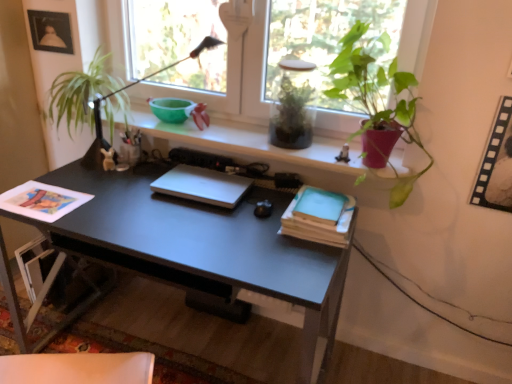
Question: Is matte white shelf at upper center positioned far away from light blue matte paper at center right, the second paperback book when ordered from bottom to top?

Choices:
 (A) no
 (B) yes

Answer: (A)

Question: Considering the relative sizes of matte white shelf at upper center and light blue matte paper at center right, the second paperback book when ordered from bottom to top, in the image provided, is matte white shelf at upper center taller than light blue matte paper at center right, the second paperback book when ordered from bottom to top,?

Choices:
 (A) no
 (B) yes

Answer: (B)

Question: Would you say matte white shelf at upper center contains light blue matte paper at center right, the first paperback book viewed from the top?

Choices:
 (A) yes
 (B) no

Answer: (B)

Question: Is matte white shelf at upper center smaller than light blue matte paper at center right, the second paperback book when ordered from bottom to top?

Choices:
 (A) no
 (B) yes

Answer: (A)

Question: Is matte white shelf at upper center positioned with its back to light blue matte paper at center right, the second paperback book when ordered from bottom to top?

Choices:
 (A) yes
 (B) no

Answer: (B)

Question: From a real-world perspective, is matte white shelf at upper center beneath light blue matte paper at center right, the second paperback book when ordered from bottom to top?

Choices:
 (A) yes
 (B) no

Answer: (B)

Question: Is white matte laptop at center to the right of black matte desk at center from the viewer's perspective?

Choices:
 (A) no
 (B) yes

Answer: (B)

Question: From the image's perspective, is white matte laptop at center beneath black matte desk at center?

Choices:
 (A) no
 (B) yes

Answer: (A)

Question: Is white matte laptop at center beside black matte desk at center?

Choices:
 (A) no
 (B) yes

Answer: (A)

Question: Is there a large distance between white matte laptop at center and black matte desk at center?

Choices:
 (A) no
 (B) yes

Answer: (A)

Question: Could you tell me if white matte laptop at center is facing black matte desk at center?

Choices:
 (A) no
 (B) yes

Answer: (A)

Question: Considering the relative sizes of white matte laptop at center and black matte desk at center in the image provided, is white matte laptop at center wider than black matte desk at center?

Choices:
 (A) yes
 (B) no

Answer: (B)

Question: Does white matte laptop at center have a larger size compared to filmstrip paper at upper right, the 1th picture frame ordered from the bottom?

Choices:
 (A) no
 (B) yes

Answer: (A)